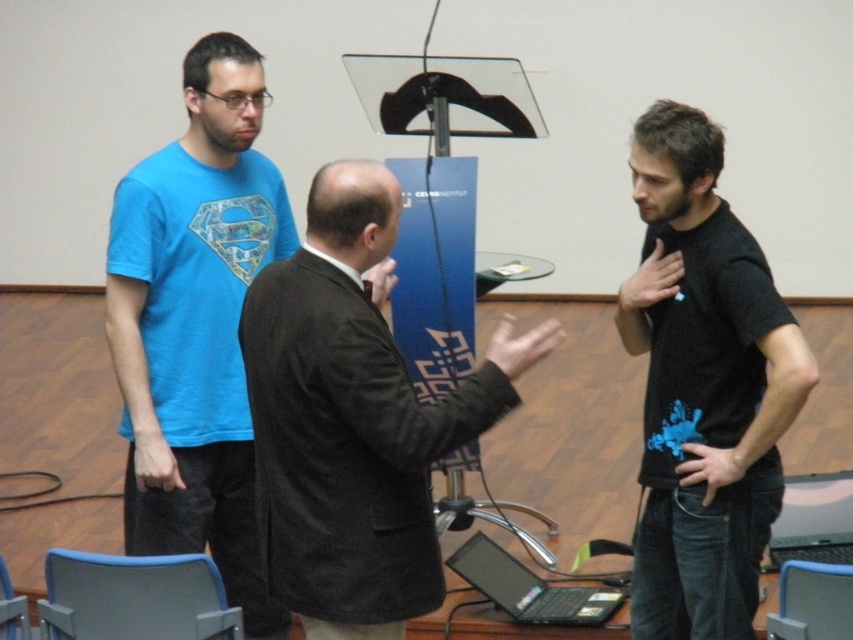
Question: Which of the following is the farthest from the observer?

Choices:
 (A) (674, 554)
 (B) (790, 529)
 (C) (328, 532)
 (D) (231, 202)

Answer: (B)

Question: Which of the following is the farthest from the observer?

Choices:
 (A) dark brown suit at center
 (B) black plastic laptop at lower right

Answer: (B)

Question: Considering the relative positions of blue matte t-shirt at left and black glossy laptop at lower center in the image provided, where is blue matte t-shirt at left located with respect to black glossy laptop at lower center?

Choices:
 (A) left
 (B) right

Answer: (A)

Question: Does black matte t-shirt at right appear on the right side of black plastic laptop at lower right?

Choices:
 (A) no
 (B) yes

Answer: (A)

Question: Where is black glossy laptop at lower center located in relation to black plastic laptop at lower right in the image?

Choices:
 (A) above
 (B) below

Answer: (B)

Question: Which point appears farthest from the camera in this image?

Choices:
 (A) (335, 483)
 (B) (692, 173)
 (C) (515, 589)
 (D) (244, 605)

Answer: (C)